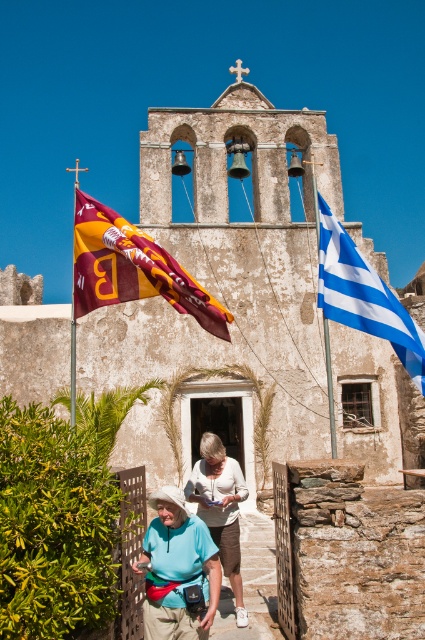
You are standing in front of the church and notice two flags. The maroon fabric flag at left and the light blue fabric at center. Which flag is positioned higher relative to the other?

The maroon fabric flag at left is positioned higher than the light blue fabric at center.

You are standing at the entrance of the rustic stone church and want to take a photo of the point at coordinates point (110, 236). Given that your camera has a maximum focus range of 40 meters, will you be able to capture the point clearly?

The distance of point (110, 236) from viewer is 38.79 meters, which is within the camera maximum focus range of 40 meters. Therefore, you can capture the point clearly.